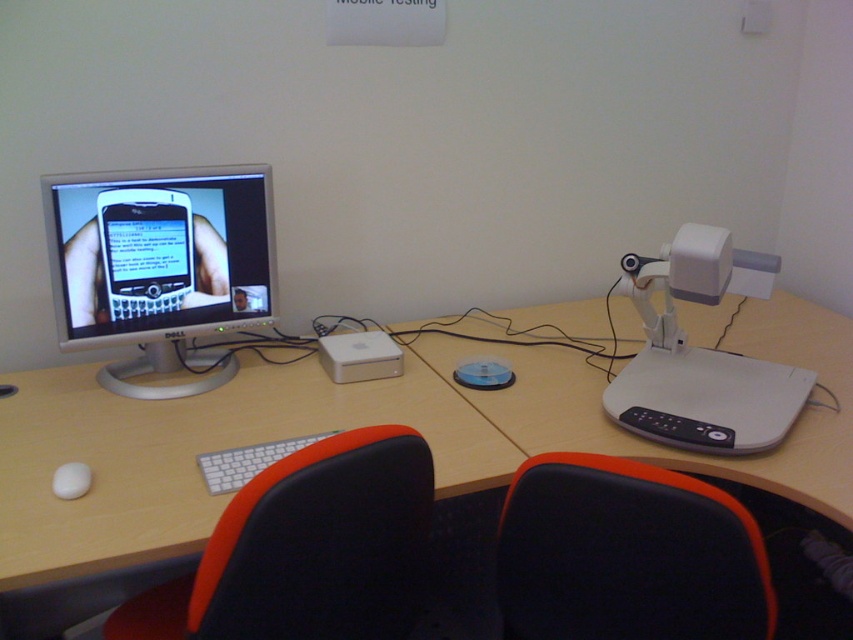
You are setting up a computer desk and need to place a white matte keyboard at center and a white matte mouse at lower left. According to the image, where should you position them relative to each other?

The white matte keyboard at center should be placed above the white matte mouse at lower left as per the image.

What are the coordinates of the white plastic table at center?

The white plastic table at center is located at coordinates point (637,435).

You are standing in front of the workspace shown in the image. There is a point at coordinates (241, 456) on the desk. If you want to place a 3.5 feet long cable from your current position to that point, will it reach?

The distance between your current position and the point at coordinates (241, 456) is 4.36 feet. Since the cable is only 3.5 feet long, it will not be sufficient to reach the point.